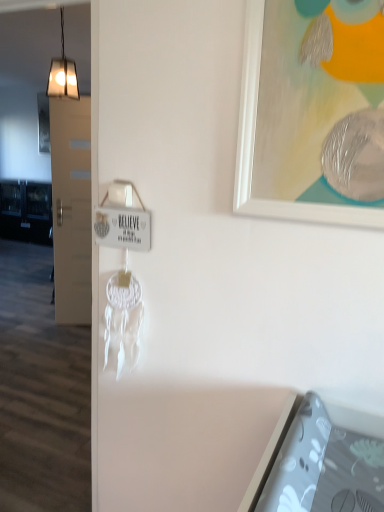
Identify the location of white matte picture frame at upper right. The height and width of the screenshot is (512, 384). (312, 112).

Describe the element at coordinates (312, 112) in the screenshot. I see `white matte picture frame at upper right` at that location.

Describe the element at coordinates (62, 72) in the screenshot. I see `metallic square light fixture at upper left` at that location.

In order to face metallic square light fixture at upper left, should I rotate leftwards or rightwards?

You should rotate left by 16.880 degrees.

Where is `metallic square light fixture at upper left`? The image size is (384, 512). metallic square light fixture at upper left is located at coordinates (62, 72).

Where is `white matte picture frame at upper right`? white matte picture frame at upper right is located at coordinates (312, 112).

Based on the photo, does white matte picture frame at upper right appear on the left side of metallic square light fixture at upper left?

Incorrect, white matte picture frame at upper right is not on the left side of metallic square light fixture at upper left.

Which object is closer to the camera taking this photo, white matte picture frame at upper right or metallic square light fixture at upper left?

white matte picture frame at upper right is in front.

Does point (355, 32) appear closer or farther from the camera than point (74, 66)?

Point (355, 32) is positioned closer to the camera compared to point (74, 66).

From the image's perspective, does white matte picture frame at upper right appear lower than metallic square light fixture at upper left?

Yes.

From a real-world perspective, is white matte picture frame at upper right positioned over metallic square light fixture at upper left based on gravity?

Actually, white matte picture frame at upper right is physically below metallic square light fixture at upper left in the real world.

Can you confirm if white matte picture frame at upper right is wider than metallic square light fixture at upper left?

In fact, white matte picture frame at upper right might be narrower than metallic square light fixture at upper left.

Which of these two, white matte picture frame at upper right or metallic square light fixture at upper left, stands taller?

Standing taller between the two is metallic square light fixture at upper left.

Considering the sizes of objects white matte picture frame at upper right and metallic square light fixture at upper left in the image provided, who is smaller, white matte picture frame at upper right or metallic square light fixture at upper left?

With smaller size is white matte picture frame at upper right.

Is white matte picture frame at upper right spatially inside metallic square light fixture at upper left, or outside of it?

white matte picture frame at upper right is located beyond the bounds of metallic square light fixture at upper left.

Is white matte picture frame at upper right next to metallic square light fixture at upper left and touching it?

There is a gap between white matte picture frame at upper right and metallic square light fixture at upper left.

In the scene shown: Could you tell me if white matte picture frame at upper right is turned towards metallic square light fixture at upper left?

No, white matte picture frame at upper right does not turn towards metallic square light fixture at upper left.

How different are the orientations of white matte picture frame at upper right and metallic square light fixture at upper left in degrees?

90.1 degrees.

How much distance is there between white matte picture frame at upper right and metallic square light fixture at upper left?

The distance of white matte picture frame at upper right from metallic square light fixture at upper left is 2.35 meters.

In the image, there is a white matte picture frame at upper right. In order to click on light above it (from the image's perspective) in this screenshot , I will do `click(62, 72)`.

Between metallic square light fixture at upper left and white matte picture frame at upper right, which one appears on the left side from the viewer's perspective?

Positioned to the left is metallic square light fixture at upper left.

Which object is more forward, metallic square light fixture at upper left or white matte picture frame at upper right?

Positioned in front is white matte picture frame at upper right.

Does point (52, 96) come in front of point (262, 4)?

No, (52, 96) is further to viewer.

From the image's perspective, between metallic square light fixture at upper left and white matte picture frame at upper right, which one is located above?

metallic square light fixture at upper left is shown above in the image.

From a real-world perspective, which object stands above the other?

metallic square light fixture at upper left.

Considering the sizes of objects metallic square light fixture at upper left and white matte picture frame at upper right in the image provided, who is thinner, metallic square light fixture at upper left or white matte picture frame at upper right?

white matte picture frame at upper right.

Does metallic square light fixture at upper left have a greater height compared to white matte picture frame at upper right?

Correct, metallic square light fixture at upper left is much taller as white matte picture frame at upper right.

Considering the sizes of objects metallic square light fixture at upper left and white matte picture frame at upper right in the image provided, who is bigger, metallic square light fixture at upper left or white matte picture frame at upper right?

metallic square light fixture at upper left is bigger.

Is metallic square light fixture at upper left located outside white matte picture frame at upper right?

Yes, metallic square light fixture at upper left is located beyond the bounds of white matte picture frame at upper right.

Is metallic square light fixture at upper left directly adjacent to white matte picture frame at upper right?

No, metallic square light fixture at upper left is not making contact with white matte picture frame at upper right.

Is metallic square light fixture at upper left looking in the opposite direction of white matte picture frame at upper right?

No, metallic square light fixture at upper left's orientation is not away from white matte picture frame at upper right.

How different are the orientations of metallic square light fixture at upper left and white matte picture frame at upper right in degrees?

The facing directions of metallic square light fixture at upper left and white matte picture frame at upper right are 90.1 degrees apart.

I want to click on picture frame below the metallic square light fixture at upper left (from a real-world perspective), so [312, 112].

Where is `picture frame on the right of metallic square light fixture at upper left`? picture frame on the right of metallic square light fixture at upper left is located at coordinates (312, 112).

The image size is (384, 512). I want to click on light behind the white matte picture frame at upper right, so click(62, 72).